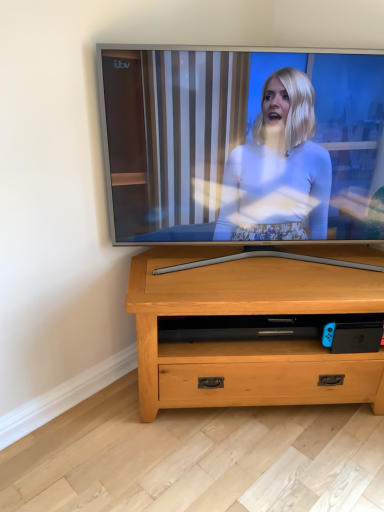
Locate an element on the screen. Image resolution: width=384 pixels, height=512 pixels. light wood chest of drawers at center is located at coordinates (248, 342).

What do you see at coordinates (248, 342) in the screenshot?
I see `light wood chest of drawers at center` at bounding box center [248, 342].

Looking at this image, what is the approximate width of silver glossy tv at center?

It is 7.54 inches.

The image size is (384, 512). What do you see at coordinates (243, 146) in the screenshot?
I see `silver glossy tv at center` at bounding box center [243, 146].

In order to click on silver glossy tv at center in this screenshot , I will do `click(243, 146)`.

The height and width of the screenshot is (512, 384). I want to click on light wood chest of drawers at center, so click(x=248, y=342).

Does silver glossy tv at center appear on the left side of light wood chest of drawers at center?

Correct, you'll find silver glossy tv at center to the left of light wood chest of drawers at center.

Considering their positions, is silver glossy tv at center located in front of or behind light wood chest of drawers at center?

silver glossy tv at center is positioned closer to the viewer than light wood chest of drawers at center.

Which point is more distant from viewer, [262,158] or [304,372]?

The point [304,372] is farther.

From the image's perspective, does silver glossy tv at center appear lower than light wood chest of drawers at center?

No, from the image's perspective, silver glossy tv at center is not beneath light wood chest of drawers at center.

From a real-world perspective, which object stands above the other?

silver glossy tv at center.

Is silver glossy tv at center wider or thinner than light wood chest of drawers at center?

In the image, silver glossy tv at center appears to be more narrow than light wood chest of drawers at center.

Is silver glossy tv at center shorter than light wood chest of drawers at center?

No.

Does silver glossy tv at center have a larger size compared to light wood chest of drawers at center?

Incorrect, silver glossy tv at center is not larger than light wood chest of drawers at center.

Based on the photo, can we say silver glossy tv at center lies outside light wood chest of drawers at center?

Yes, silver glossy tv at center is outside of light wood chest of drawers at center.

Is silver glossy tv at center in contact with light wood chest of drawers at center?

No, silver glossy tv at center is not beside light wood chest of drawers at center.

Is silver glossy tv at center turned away from light wood chest of drawers at center?

No, silver glossy tv at center is not facing away from light wood chest of drawers at center.

The image size is (384, 512). What are the coordinates of `the chest of drawers lying behind the silver glossy tv at center` in the screenshot? It's located at (248, 342).

Is light wood chest of drawers at center at the left side of silver glossy tv at center?

In fact, light wood chest of drawers at center is to the right of silver glossy tv at center.

Which object is closer to the camera, light wood chest of drawers at center or silver glossy tv at center?

silver glossy tv at center is in front.

Is point (142, 342) closer or farther from the camera than point (312, 227)?

Point (142, 342) is closer to the camera than point (312, 227).

From the image's perspective, is light wood chest of drawers at center beneath silver glossy tv at center?

Yes.

From a real-world perspective, is light wood chest of drawers at center beneath silver glossy tv at center?

Yes, from a real-world perspective, light wood chest of drawers at center is beneath silver glossy tv at center.

Is light wood chest of drawers at center wider or thinner than silver glossy tv at center?

Considering their sizes, light wood chest of drawers at center looks broader than silver glossy tv at center.

Who is taller, light wood chest of drawers at center or silver glossy tv at center?

Standing taller between the two is silver glossy tv at center.

Between light wood chest of drawers at center and silver glossy tv at center, which one has smaller size?

silver glossy tv at center is smaller.

Would you say light wood chest of drawers at center contains silver glossy tv at center?

That's incorrect, silver glossy tv at center is not inside light wood chest of drawers at center.

Is light wood chest of drawers at center next to silver glossy tv at center and touching it?

No, light wood chest of drawers at center is not with silver glossy tv at center.

Based on the photo, is light wood chest of drawers at center facing away from silver glossy tv at center?

light wood chest of drawers at center does not have its back to silver glossy tv at center.

What's the angular difference between light wood chest of drawers at center and silver glossy tv at center's facing directions?

light wood chest of drawers at center and silver glossy tv at center are facing 0.356 degrees away from each other.

Identify the location of television located on the left of light wood chest of drawers at center. (243, 146).

Where is `the chest of drawers below the silver glossy tv at center (from the image's perspective)`? This screenshot has height=512, width=384. the chest of drawers below the silver glossy tv at center (from the image's perspective) is located at coordinates (248, 342).

Where is `television to the left of light wood chest of drawers at center`? The height and width of the screenshot is (512, 384). television to the left of light wood chest of drawers at center is located at coordinates (243, 146).